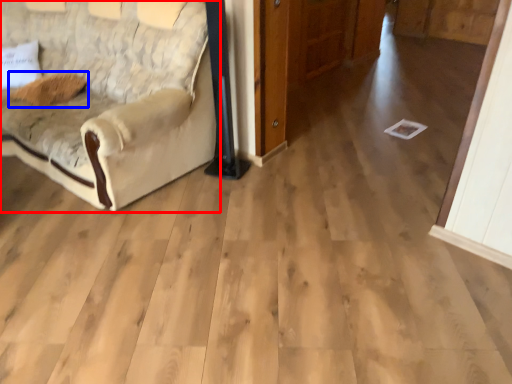
Question: Among these objects, which one is farthest to the camera, studio couch (highlighted by a red box) or pillow (highlighted by a blue box)?

Choices:
 (A) studio couch
 (B) pillow

Answer: (B)